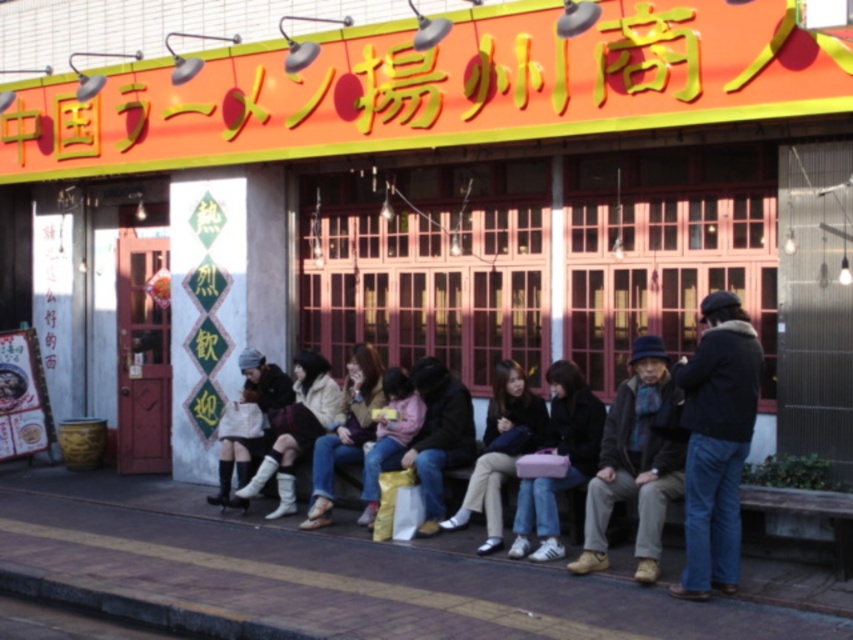
Can you confirm if light brown leather jacket at center is positioned above white leather boots at lower left?

No.

Can you confirm if light brown leather jacket at center is positioned to the left of white leather boots at lower left?

Incorrect, light brown leather jacket at center is not on the left side of white leather boots at lower left.

What do you see at coordinates (500, 449) in the screenshot? I see `light brown leather jacket at center` at bounding box center [500, 449].

Identify the location of light brown leather jacket at center. (500, 449).

Does dark blue jeans at center have a lesser height compared to denim jacket at center?

Indeed, dark blue jeans at center has a lesser height compared to denim jacket at center.

Is point (428, 364) behind point (355, 460)?

Yes, it is behind point (355, 460).

Describe the element at coordinates (438, 435) in the screenshot. The width and height of the screenshot is (853, 640). I see `dark blue jeans at center` at that location.

This screenshot has height=640, width=853. Identify the location of dark blue jeans at center. (438, 435).

At what (x,y) coordinates should I click in order to perform the action: click on pink fabric bag at center. Please return your answer as a coordinate pair (x, y). Image resolution: width=853 pixels, height=640 pixels. Looking at the image, I should click on (560, 454).

Does pink fabric bag at center appear on the right side of matte pink sweater at center?

Yes, pink fabric bag at center is to the right of matte pink sweater at center.

Locate an element on the screen. pink fabric bag at center is located at coordinates (560, 454).

Find the location of `pink fabric bag at center`. pink fabric bag at center is located at coordinates 560,454.